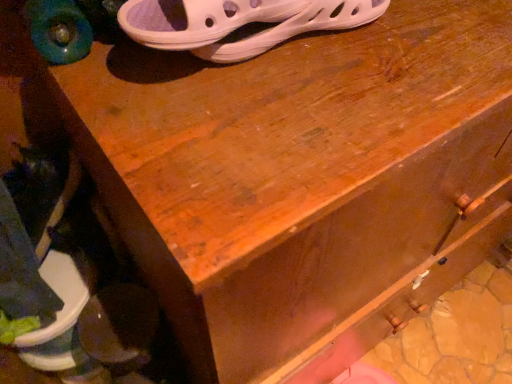
Question: Is white mesh sandal at upper center, which is counted as the 2th footwear, starting from the back, at the left side of dark brown leather shoe at lower left, placed as the 2th footwear when sorted from right to left?

Choices:
 (A) yes
 (B) no

Answer: (B)

Question: Is white mesh sandal at upper center, which is the 1th footwear from top to bottom, far from dark brown leather shoe at lower left, the 1th footwear positioned from the back?

Choices:
 (A) yes
 (B) no

Answer: (B)

Question: Is white mesh sandal at upper center, which is the 1th footwear from right to left, closer to camera compared to dark brown leather shoe at lower left, positioned as the first footwear in left-to-right order?

Choices:
 (A) yes
 (B) no

Answer: (A)

Question: Could you tell me if white mesh sandal at upper center, which is the 1th footwear from top to bottom, is turned towards dark brown leather shoe at lower left, the 2th footwear in the front-to-back sequence?

Choices:
 (A) no
 (B) yes

Answer: (A)

Question: Does white mesh sandal at upper center, which is the 1th footwear from top to bottom, have a smaller size compared to dark brown leather shoe at lower left, acting as the 2th footwear starting from the top?

Choices:
 (A) no
 (B) yes

Answer: (B)

Question: From the image's perspective, is white mesh sandal at upper center, the first footwear in the front-to-back sequence, beneath dark brown leather shoe at lower left, the 1th footwear positioned from the back?

Choices:
 (A) no
 (B) yes

Answer: (A)

Question: Is white mesh sandal at upper center, which is the 1th footwear from right to left, completely or partially inside dark brown leather shoe at lower left, which is the first footwear in bottom-to-top order?

Choices:
 (A) no
 (B) yes

Answer: (A)

Question: Is dark brown leather shoe at lower left, positioned as the first footwear in left-to-right order, shorter than white mesh sandal at upper center, arranged as the 2th footwear when ordered from the bottom?

Choices:
 (A) yes
 (B) no

Answer: (B)

Question: From the image's perspective, is dark brown leather shoe at lower left, positioned as the first footwear in left-to-right order, located above white mesh sandal at upper center, which appears as the 2th footwear when viewed from the left?

Choices:
 (A) no
 (B) yes

Answer: (A)

Question: Does dark brown leather shoe at lower left, placed as the 2th footwear when sorted from right to left, appear on the left side of white mesh sandal at upper center, the first footwear in the front-to-back sequence?

Choices:
 (A) yes
 (B) no

Answer: (A)

Question: Is dark brown leather shoe at lower left, which is the first footwear in bottom-to-top order, to the right of white mesh sandal at upper center, which appears as the 2th footwear when viewed from the left, from the viewer's perspective?

Choices:
 (A) yes
 (B) no

Answer: (B)

Question: Is dark brown leather shoe at lower left, positioned as the first footwear in left-to-right order, closer to camera compared to white mesh sandal at upper center, which is the 1th footwear from right to left?

Choices:
 (A) yes
 (B) no

Answer: (B)

Question: From a real-world perspective, relative to dark brown leather shoe at lower left, acting as the 2th footwear starting from the top, is white mesh sandal at upper center, which appears as the 2th footwear when viewed from the left, vertically above or below?

Choices:
 (A) above
 (B) below

Answer: (A)